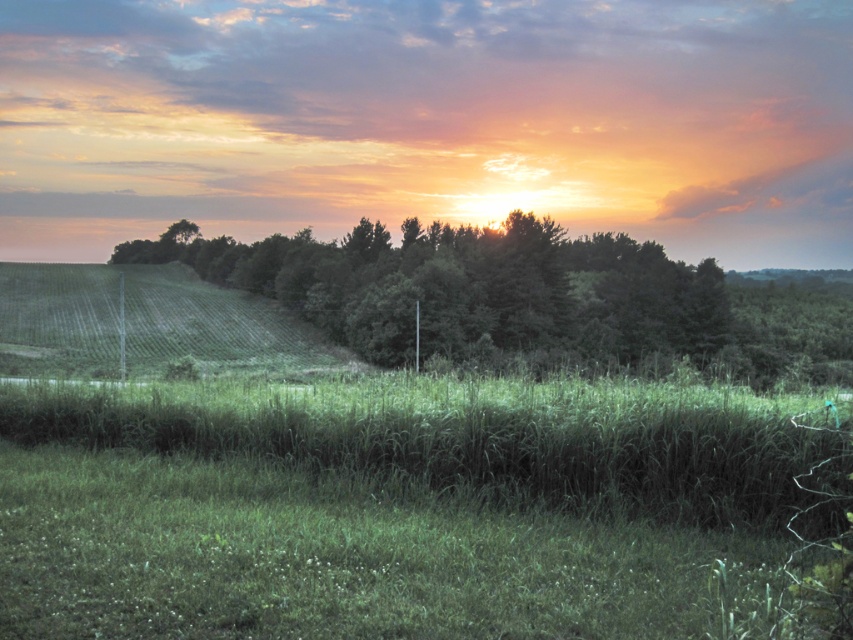
Does green grassy at center appear over green grassy hillside at left?

No.

Is point (660, 602) in front of point (190, 348)?

Yes, it is.

Does point (263, 586) lie behind point (219, 352)?

No, it is in front of (219, 352).

This screenshot has height=640, width=853. I want to click on green grassy at center, so click(384, 506).

Can you confirm if green leafy trees at center is bigger than green grassy hillside at left?

Yes, green leafy trees at center is bigger than green grassy hillside at left.

Who is more forward, (787,316) or (33,353)?

Point (33,353) is more forward.

Where is `green leafy trees at center`? green leafy trees at center is located at coordinates (523, 296).

Does green grassy at center have a smaller size compared to green leafy trees at center?

Indeed, green grassy at center has a smaller size compared to green leafy trees at center.

Is green grassy at center behind green leafy trees at center?

No, it is in front of green leafy trees at center.

Is point (653, 481) positioned in front of point (387, 324)?

Yes, point (653, 481) is in front of point (387, 324).

The height and width of the screenshot is (640, 853). I want to click on green grassy at center, so [x=384, y=506].